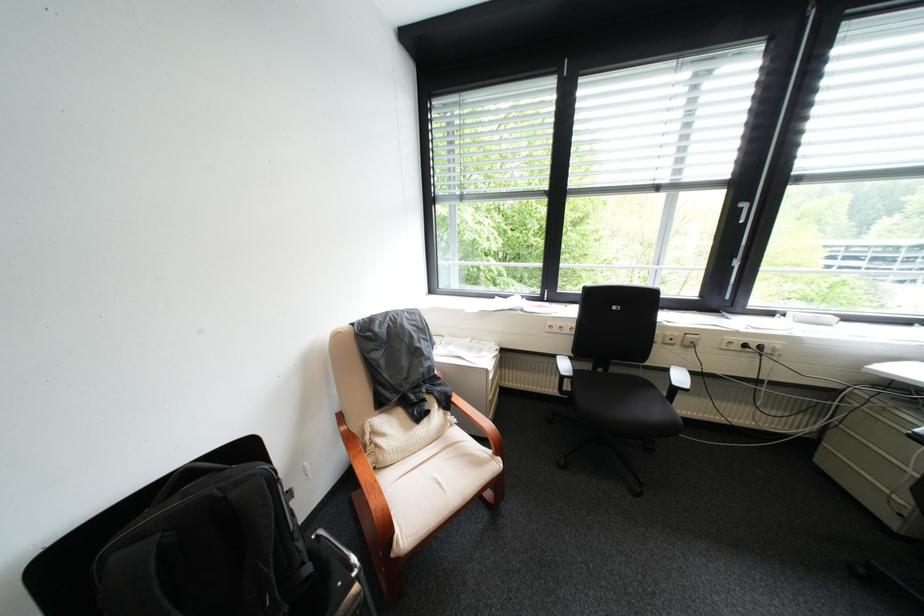
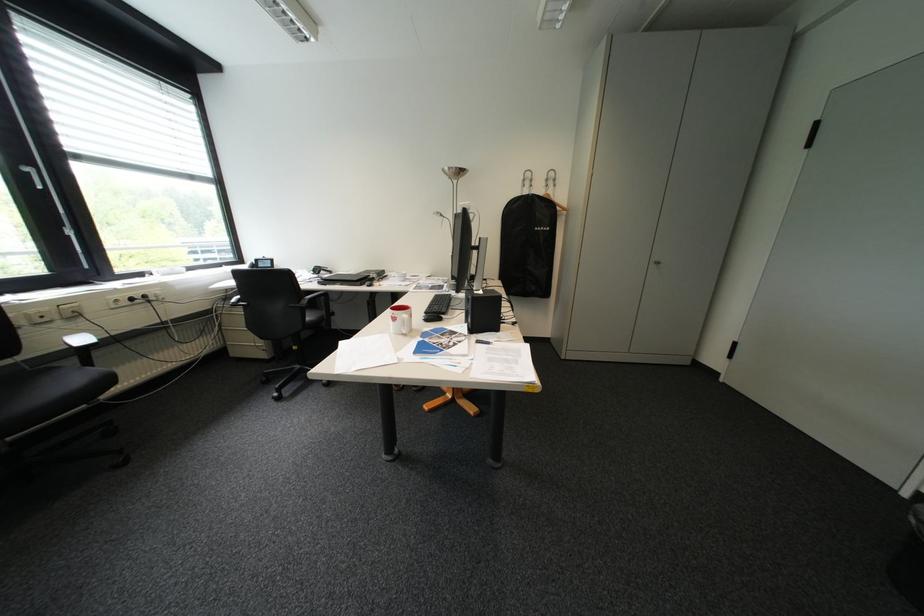
Find the pixel in the second image that matches (749,204) in the first image.

(30, 167)